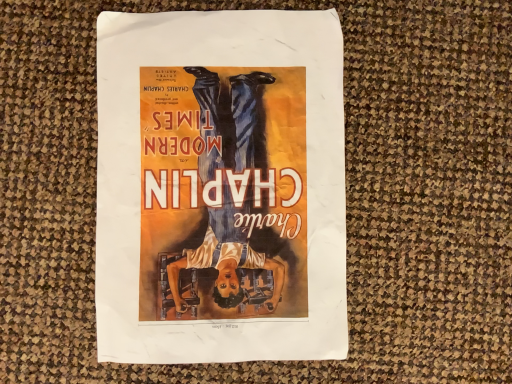
You are a GUI agent. You are given a task and a screenshot of the screen. Output one action in this format:
    pyautogui.click(x=<x>, y=<y>)
    Task: Click on the matte paper poster at center
    
    Given the screenshot: What is the action you would take?
    pyautogui.click(x=220, y=187)

The height and width of the screenshot is (384, 512). Describe the element at coordinates (220, 187) in the screenshot. I see `matte paper poster at center` at that location.

Identify the location of matte paper poster at center. (220, 187).